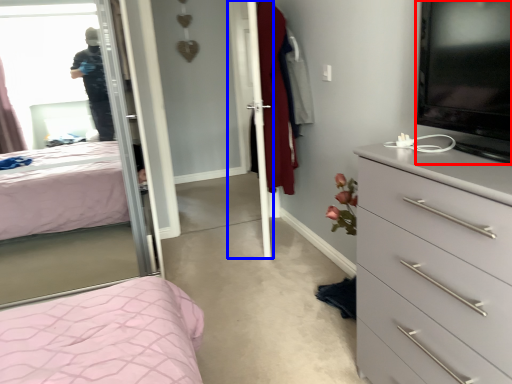
Question: Which point is closer to the camera, television (highlighted by a red box) or screen door (highlighted by a blue box)?

Choices:
 (A) television
 (B) screen door

Answer: (A)